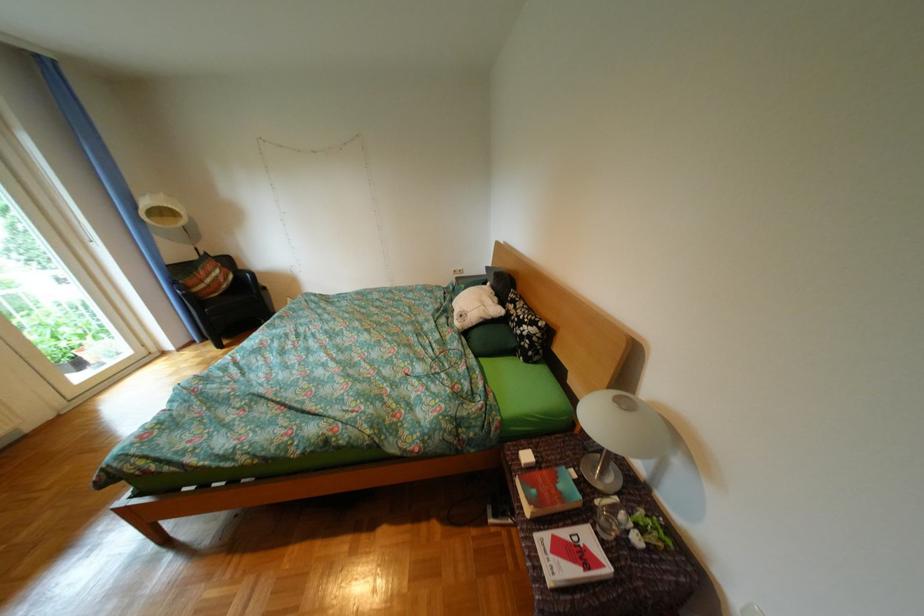
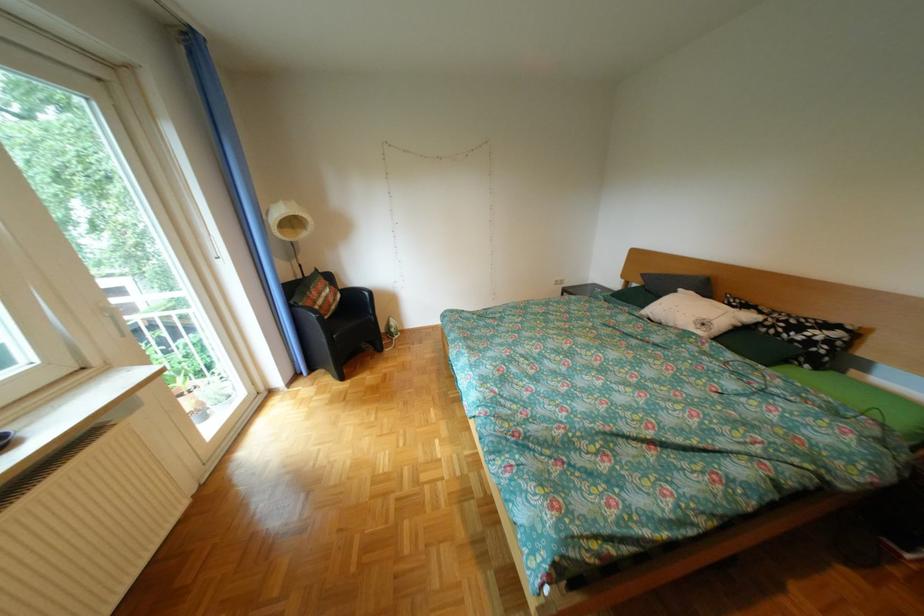
Where in the second image is the point corresponding to (x=188, y=284) from the first image?

(306, 307)